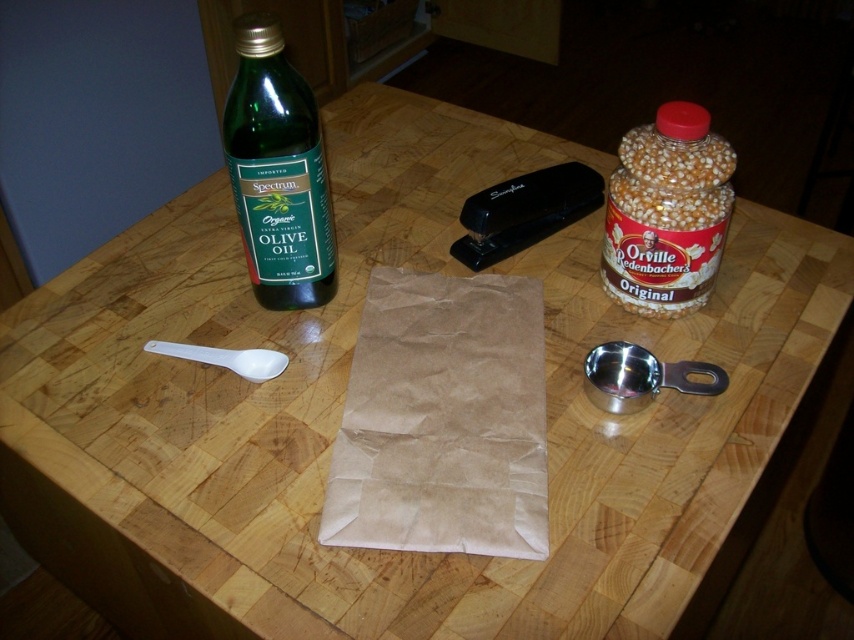
Between brown paper bag at center and translucent plastic popcorn container at right, which one is positioned higher?

translucent plastic popcorn container at right is higher up.

Does point (519, 365) lie behind point (668, 156)?

Yes.

Describe the element at coordinates (443, 419) in the screenshot. The height and width of the screenshot is (640, 854). I see `brown paper bag at center` at that location.

Find the location of a particular element. The image size is (854, 640). brown paper bag at center is located at coordinates (443, 419).

Does brown paper bag at center have a greater height compared to white plastic spoon at left?

Correct, brown paper bag at center is much taller as white plastic spoon at left.

Is brown paper bag at center above white plastic spoon at left?

No, brown paper bag at center is not above white plastic spoon at left.

Is point (375, 310) closer to viewer compared to point (243, 353)?

No, it is not.

This screenshot has width=854, height=640. Find the location of `brown paper bag at center`. brown paper bag at center is located at coordinates (443, 419).

Based on the photo, can you confirm if green glass bottle at left is wider than translucent plastic popcorn container at right?

In fact, green glass bottle at left might be narrower than translucent plastic popcorn container at right.

Is point (246, 170) farther from viewer compared to point (689, 291)?

No, (246, 170) is closer to viewer.

Does point (320, 280) come behind point (687, 268)?

Yes, point (320, 280) is behind point (687, 268).

At what (x,y) coordinates should I click in order to perform the action: click on green glass bottle at left. Please return your answer as a coordinate pair (x, y). The image size is (854, 640). Looking at the image, I should click on (278, 172).